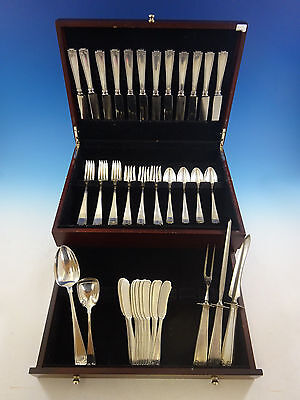
You are a GUI agent. You are given a task and a screenshot of the screen. Output one action in this format:
    pyautogui.click(x=<x>, y=<y>)
    Task: Click on the spoons
    This screenshot has height=400, width=300.
    Given the screenshot: What is the action you would take?
    pyautogui.click(x=72, y=268), pyautogui.click(x=89, y=288), pyautogui.click(x=171, y=176), pyautogui.click(x=184, y=177), pyautogui.click(x=195, y=176), pyautogui.click(x=207, y=177)